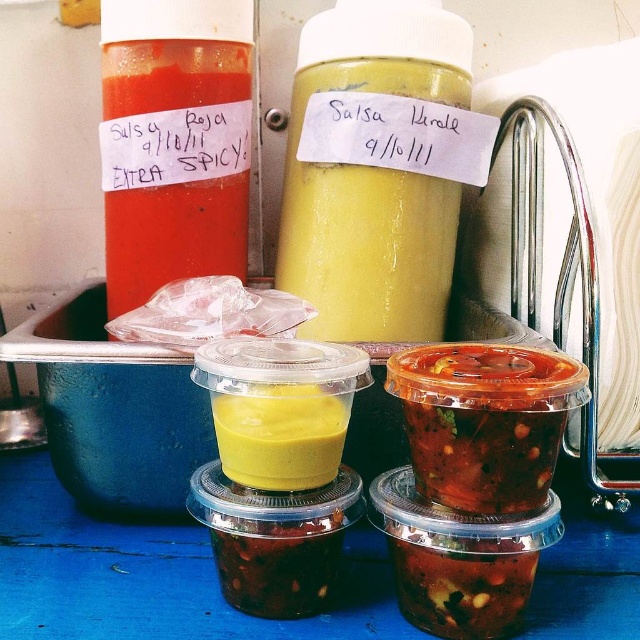
You are a customer at a grocery store looking for a sauce container with a matte finish. You see the point marked at coordinates (x=173, y=164). What object is located there?

The point at coordinates (x=173, y=164) indicates a matte plastic bottle at upper left.

You are a food service worker who needs to choose a container to hold a new batch of hot sauce. The yellow matte plastic cup at center and the shiny plastic container at center are available. Which container has a wider opening to accommodate the sauce more easily?

The shiny plastic container at center has a greater width, so it has a wider opening and can accommodate the sauce more easily than the yellow matte plastic cup at center.